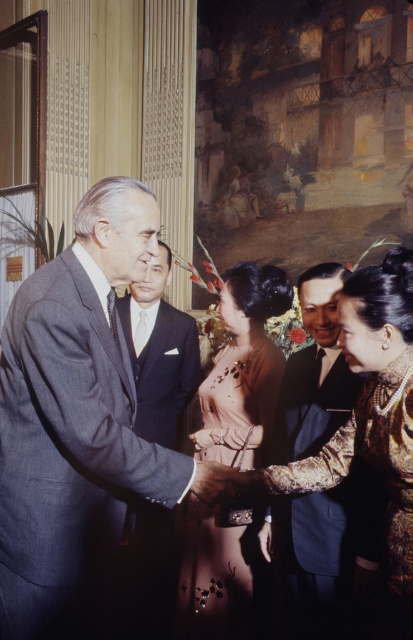
Looking at this image, you are a photographer positioned at the camera. You need to take a photo of the dark blue suit at center. Considering the distance between you and the suit, can you use a standard 50mm lens to capture a clear, full body shot without zooming? Explain your reasoning.

The distance between the dark blue suit at center and the camera is 2.80 meters. A standard 50mm lens on a full frame camera typically requires a distance of at least 3 meters to capture a full body shot without severe cropping or zooming. Therefore, at 2.80 meters, the photographer would need to either step back slightly or use a slightly wider lens to ensure the entire subject is in frame.

You are organizing a photo shoot and need to arrange two suits in a display case. The display case has a width limit of 1.2 meters. Given the information provided, can both the matte black suit at center and the dark gray wool suit at left fit side by side in the display case without overlapping?

The matte black suit at center might be wider than dark gray wool suit at left. Since the exact widths are not specified, but the matte black suit could be wider, there is a possibility that together they exceed the 1.2 meter limit. To ensure they fit, you should check the combined width of both suits against the display case limit.